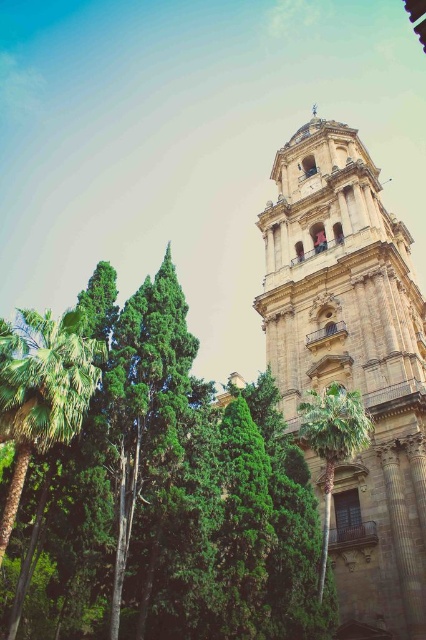
Which is more to the right, green leafy palm tree at lower left or green leafy palm tree at center?

Positioned to the right is green leafy palm tree at center.

Does green leafy palm tree at lower left have a lesser width compared to green leafy palm tree at center?

No.

Find the location of a particular element. The width and height of the screenshot is (426, 640). green leafy palm tree at lower left is located at coordinates (43, 390).

I want to click on green leafy palm tree at lower left, so click(x=43, y=390).

This screenshot has height=640, width=426. Describe the element at coordinates (169, 493) in the screenshot. I see `green leafy tree at center` at that location.

Is green leafy tree at center taller than golden stone bell tower at right?

No.

Which is behind, point (6, 566) or point (296, 188)?

The point (296, 188) is more distant.

This screenshot has width=426, height=640. I want to click on green leafy tree at center, so click(169, 493).

Who is positioned more to the right, green leafy tree at center or green leafy palm tree at center?

From the viewer's perspective, green leafy palm tree at center appears more on the right side.

Is point (299, 577) behind point (325, 417)?

No, it is not.

I want to click on green leafy tree at center, so click(x=169, y=493).